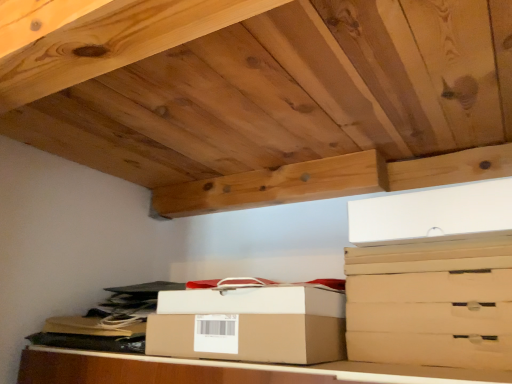
Question: Considering the relative positions of brown cardboard drawer at right, acting as the 4th drawer starting from the bottom, and matte cardboard drawer at lower right, the second drawer when ordered from bottom to top, in the image provided, is brown cardboard drawer at right, acting as the 4th drawer starting from the bottom, to the left of matte cardboard drawer at lower right, the second drawer when ordered from bottom to top, from the viewer's perspective?

Choices:
 (A) yes
 (B) no

Answer: (B)

Question: Is brown cardboard drawer at right, acting as the 4th drawer starting from the bottom, shorter than matte cardboard drawer at lower right, the third drawer viewed from the top?

Choices:
 (A) no
 (B) yes

Answer: (B)

Question: Is brown cardboard drawer at right, the 1th drawer positioned from the top, in front of matte cardboard drawer at lower right, the third drawer viewed from the top?

Choices:
 (A) yes
 (B) no

Answer: (A)

Question: Does brown cardboard drawer at right, the 1th drawer positioned from the top, touch matte cardboard drawer at lower right, the second drawer when ordered from bottom to top?

Choices:
 (A) yes
 (B) no

Answer: (A)

Question: Considering the relative sizes of brown cardboard drawer at right, the 1th drawer positioned from the top, and matte cardboard drawer at lower right, the second drawer when ordered from bottom to top, in the image provided, is brown cardboard drawer at right, the 1th drawer positioned from the top, thinner than matte cardboard drawer at lower right, the second drawer when ordered from bottom to top,?

Choices:
 (A) yes
 (B) no

Answer: (B)

Question: Would you say brown cardboard drawer at lower right, which is the 4th drawer in top-to-bottom order, is to the left or to the right of brown cardboard box at center in the picture?

Choices:
 (A) left
 (B) right

Answer: (B)

Question: Looking at the image, does brown cardboard drawer at lower right, which is the 4th drawer in top-to-bottom order, seem bigger or smaller compared to brown cardboard box at center?

Choices:
 (A) small
 (B) big

Answer: (A)

Question: In the image, is brown cardboard drawer at lower right, arranged as the 1th drawer when ordered from the bottom, positioned in front of or behind brown cardboard box at center?

Choices:
 (A) front
 (B) behind

Answer: (B)

Question: Do you think brown cardboard drawer at lower right, arranged as the 1th drawer when ordered from the bottom, is within brown cardboard box at center, or outside of it?

Choices:
 (A) inside
 (B) outside

Answer: (B)

Question: From a real-world perspective, relative to matte cardboard drawer at center right, the 3th drawer when ordered from bottom to top, is matte cardboard drawer at lower right, the third drawer viewed from the top, vertically above or below?

Choices:
 (A) above
 (B) below

Answer: (B)

Question: From the image's perspective, is matte cardboard drawer at lower right, the second drawer when ordered from bottom to top, positioned above or below matte cardboard drawer at center right, the 2th drawer positioned from the top?

Choices:
 (A) above
 (B) below

Answer: (B)

Question: Would you say matte cardboard drawer at lower right, the third drawer viewed from the top, is inside or outside matte cardboard drawer at center right, the 2th drawer positioned from the top?

Choices:
 (A) inside
 (B) outside

Answer: (B)

Question: Considering the positions of matte cardboard drawer at lower right, the third drawer viewed from the top, and matte cardboard drawer at center right, the 2th drawer positioned from the top, in the image, is matte cardboard drawer at lower right, the third drawer viewed from the top, wider or thinner than matte cardboard drawer at center right, the 2th drawer positioned from the top,?

Choices:
 (A) wide
 (B) thin

Answer: (B)

Question: Is brown cardboard drawer at right, acting as the 4th drawer starting from the bottom, inside the boundaries of brown cardboard box at center, or outside?

Choices:
 (A) inside
 (B) outside

Answer: (B)

Question: In the image, is brown cardboard drawer at right, the 1th drawer positioned from the top, positioned in front of or behind brown cardboard box at center?

Choices:
 (A) front
 (B) behind

Answer: (B)